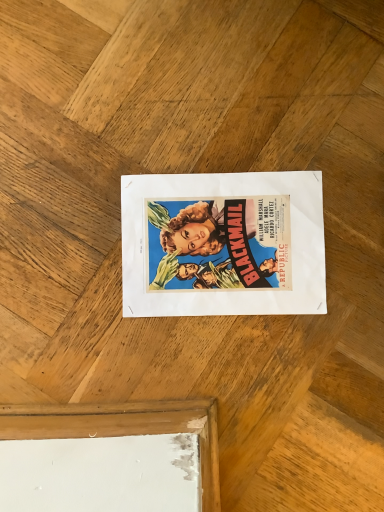
This screenshot has width=384, height=512. Describe the element at coordinates (223, 244) in the screenshot. I see `matte paper poster at center` at that location.

Measure the distance between matte paper poster at center and camera.

matte paper poster at center is 24.20 inches away from camera.

Where is `matte paper poster at center`? matte paper poster at center is located at coordinates (223, 244).

Locate an element on the screen. matte paper poster at center is located at coordinates (223, 244).